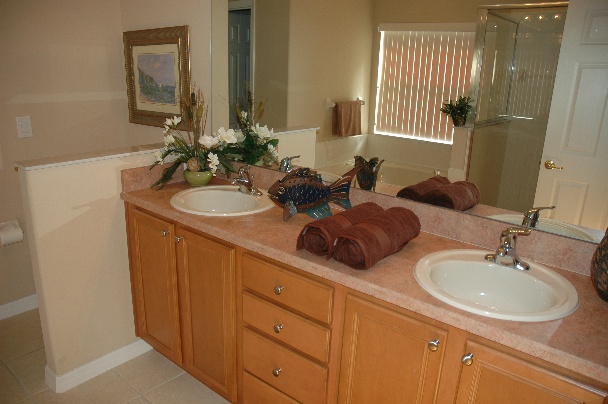
At what (x,y) coordinates should I click in order to perform the action: click on knob. Please return your answer as a coordinate pair (x, y). Looking at the image, I should click on (440, 353), (469, 357), (280, 282), (280, 321), (278, 361).